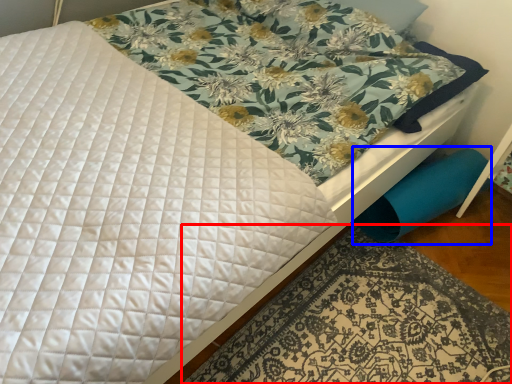
Question: Which point is closer to the camera, mat (highlighted by a red box) or swivel chair (highlighted by a blue box)?

Choices:
 (A) mat
 (B) swivel chair

Answer: (A)